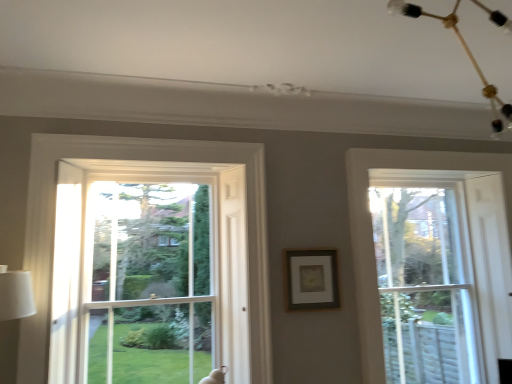
Question: In the image, is gold metallic chandelier at upper right positioned in front of or behind clear glass window screen at center?

Choices:
 (A) behind
 (B) front

Answer: (B)

Question: From a real-world perspective, relative to clear glass window screen at center, is gold metallic chandelier at upper right vertically above or below?

Choices:
 (A) above
 (B) below

Answer: (A)

Question: Which object is the farthest from the gold metallic chandelier at upper right?

Choices:
 (A) clear glass window at right
 (B) clear glass window screen at center
 (C) matte gold picture frame at center

Answer: (B)

Question: Which of these objects is positioned farthest from the clear glass window screen at center?

Choices:
 (A) matte gold picture frame at center
 (B) gold metallic chandelier at upper right
 (C) clear glass window at right

Answer: (B)